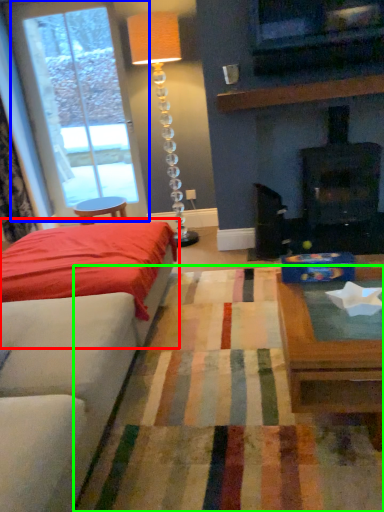
Question: Which is nearer to the bed (highlighted by a red box)? window (highlighted by a blue box) or plain (highlighted by a green box).

Choices:
 (A) window
 (B) plain

Answer: (B)